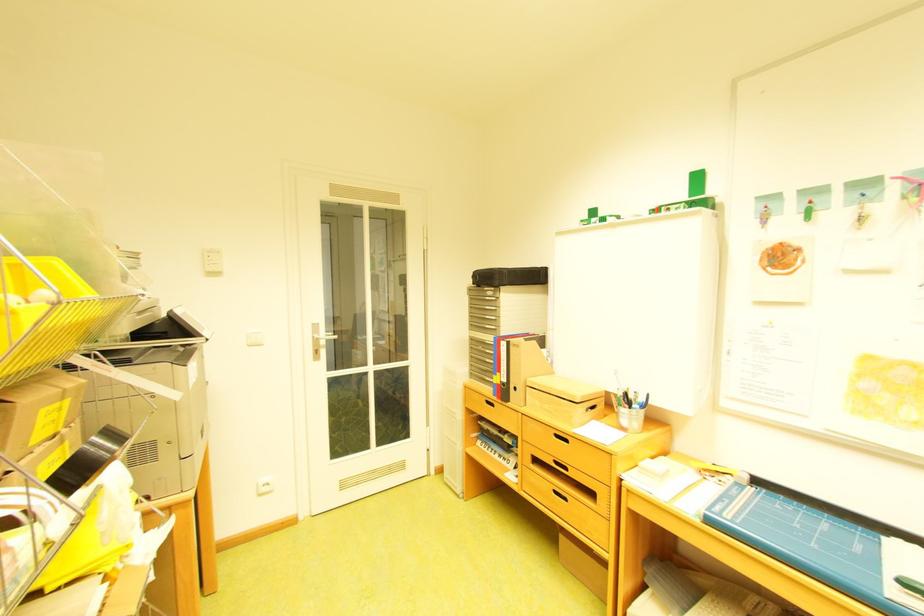
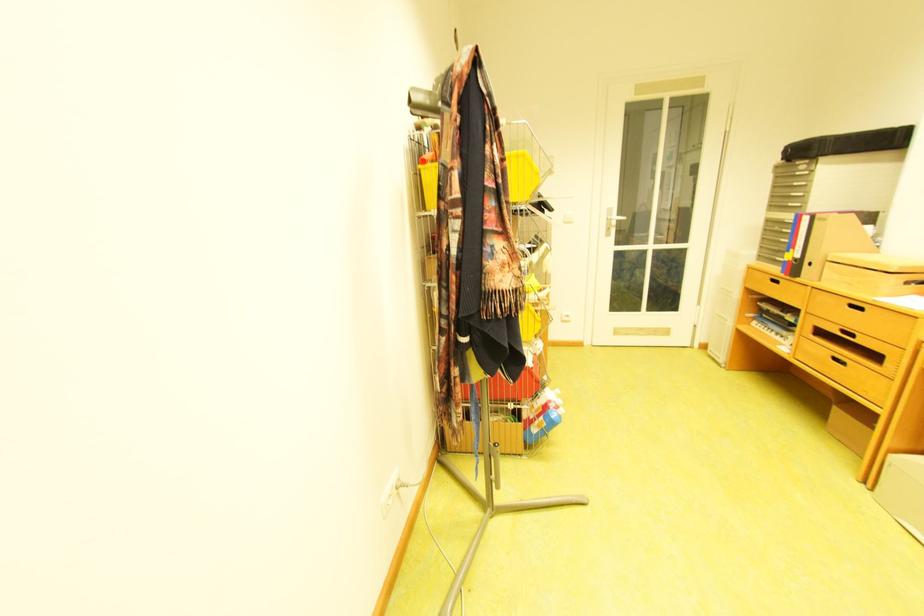
Where in the second image is the point corresponding to point (516, 382) from the first image?

(809, 257)